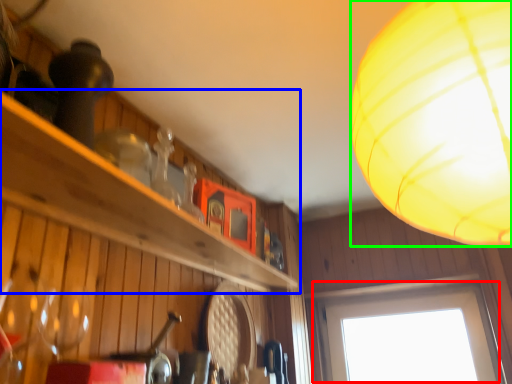
Question: Which is farther away from window (highlighted by a red box)? shelf (highlighted by a blue box) or lamp (highlighted by a green box)?

Choices:
 (A) shelf
 (B) lamp

Answer: (B)